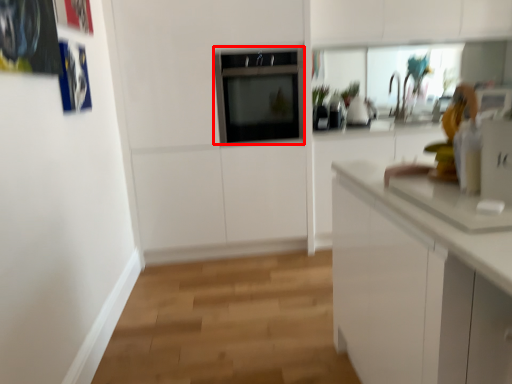
Question: From the image's perspective, what is the correct spatial positioning of oven (annotated by the red box) in reference to appliance?

Choices:
 (A) below
 (B) above

Answer: (B)